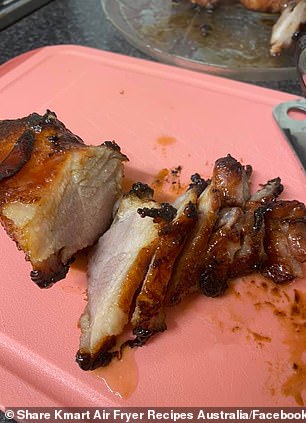
This screenshot has width=306, height=423. Identify the location of plate. 204,44.